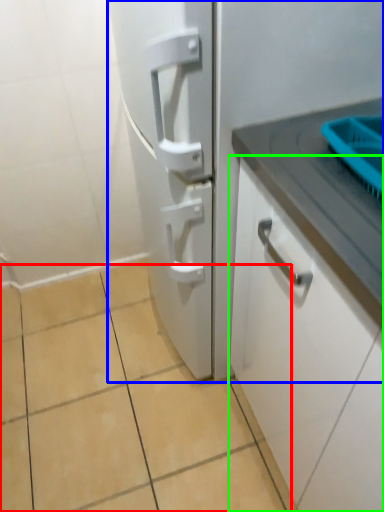
Question: Considering the real-world distances, which object is farthest from ceramic tile (highlighted by a red box)? refrigerator (highlighted by a blue box) or cabinetry (highlighted by a green box)?

Choices:
 (A) refrigerator
 (B) cabinetry

Answer: (B)